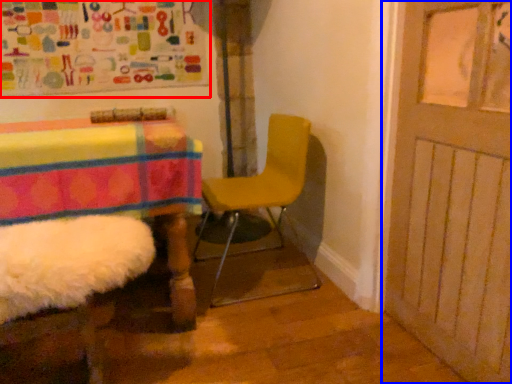
Question: Which of the following is the farthest to the observer, bulletin board (highlighted by a red box) or door (highlighted by a blue box)?

Choices:
 (A) bulletin board
 (B) door

Answer: (A)